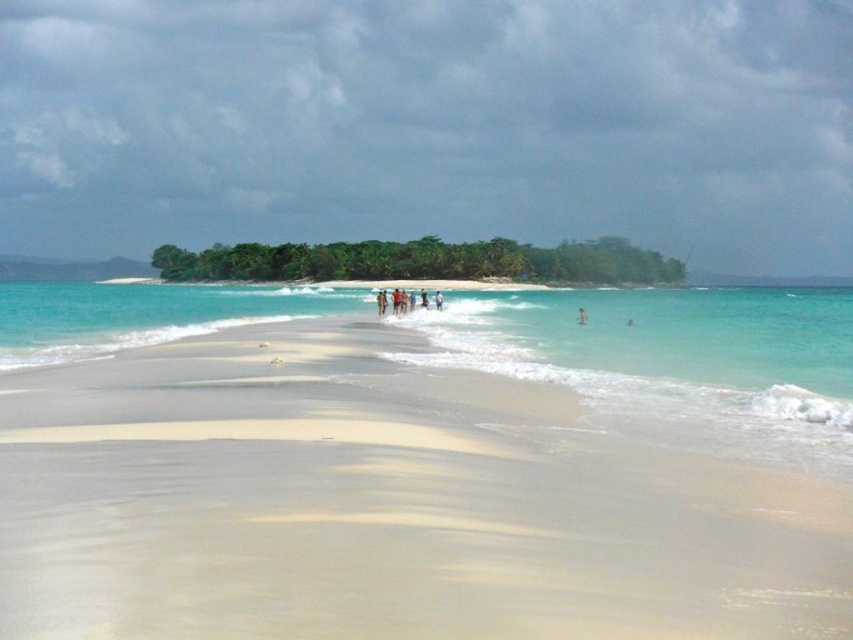
Question: Where is green leafy island at center located in relation to skinny person at center in the image?

Choices:
 (A) right
 (B) left

Answer: (B)

Question: Which point is farther from the camera taking this photo?

Choices:
 (A) (579, 310)
 (B) (543, 282)

Answer: (B)

Question: Is white sand beach at center below green leafy island at center?

Choices:
 (A) yes
 (B) no

Answer: (A)

Question: Is white sand beach at center positioned before skinny person at center?

Choices:
 (A) no
 (B) yes

Answer: (B)

Question: Estimate the real-world distances between objects in this image. Which object is farther from the white sand beach at center?

Choices:
 (A) green leafy island at center
 (B) skinny person at center

Answer: (A)

Question: Which object is positioned closest to the white sand beach at center?

Choices:
 (A) skinny person at center
 (B) green leafy island at center

Answer: (A)